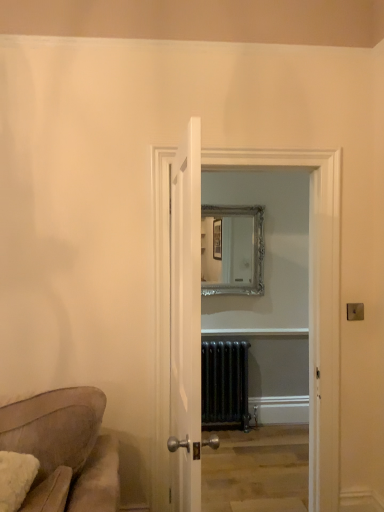
Question: Is metallic gold light switch at upper right taller than black metal radiator at center?

Choices:
 (A) yes
 (B) no

Answer: (B)

Question: Is metallic gold light switch at upper right at the left side of black metal radiator at center?

Choices:
 (A) yes
 (B) no

Answer: (B)

Question: Is metallic gold light switch at upper right placed right next to black metal radiator at center?

Choices:
 (A) no
 (B) yes

Answer: (A)

Question: Can you confirm if metallic gold light switch at upper right is smaller than black metal radiator at center?

Choices:
 (A) yes
 (B) no

Answer: (A)

Question: From a real-world perspective, is metallic gold light switch at upper right below black metal radiator at center?

Choices:
 (A) no
 (B) yes

Answer: (A)

Question: Is metallic gold light switch at upper right positioned beyond the bounds of black metal radiator at center?

Choices:
 (A) yes
 (B) no

Answer: (A)

Question: Is white wooden door at center in contact with clear glass door at center?

Choices:
 (A) no
 (B) yes

Answer: (A)

Question: Is white wooden door at center oriented towards clear glass door at center?

Choices:
 (A) yes
 (B) no

Answer: (B)

Question: Does white wooden door at center lie in front of clear glass door at center?

Choices:
 (A) yes
 (B) no

Answer: (A)

Question: Does white wooden door at center have a greater height compared to clear glass door at center?

Choices:
 (A) yes
 (B) no

Answer: (B)

Question: Is white wooden door at center to the left of clear glass door at center from the viewer's perspective?

Choices:
 (A) yes
 (B) no

Answer: (A)

Question: Does white wooden door at center have a greater width compared to clear glass door at center?

Choices:
 (A) yes
 (B) no

Answer: (B)

Question: Can you confirm if clear glass door at center is smaller than white wooden door at center?

Choices:
 (A) yes
 (B) no

Answer: (B)